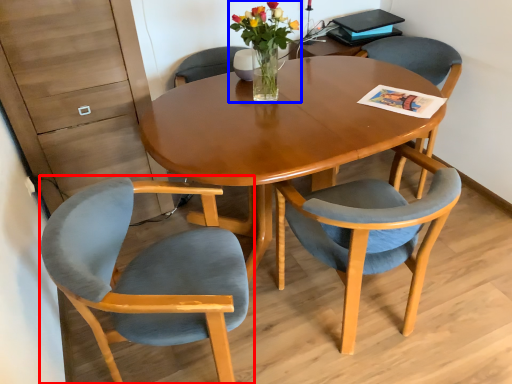
Question: Which point is further to the camera, chair (highlighted by a red box) or floral arrangement (highlighted by a blue box)?

Choices:
 (A) chair
 (B) floral arrangement

Answer: (B)